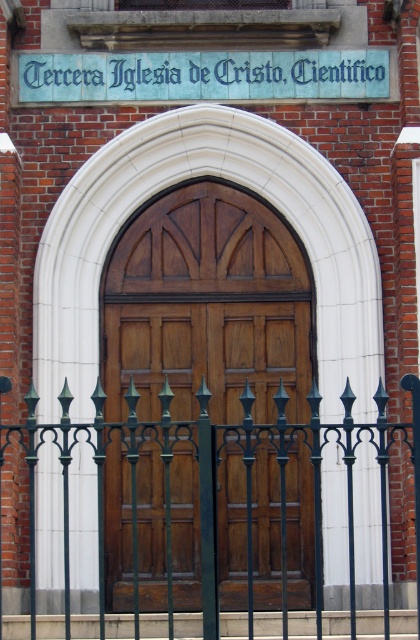
Consider the image. You are a delivery person trying to enter the Tercera Iglesia de Cristo, Cientifico building. You see the polished wood door at center and the green wrought iron fence at center. Which object is positioned higher relative to the other?

The polished wood door at center is above the green wrought iron fence at center, so the door is higher.

Based on the photo, you are standing at the entrance of the Tercera Iglesia de Cristo, Cientifico and looking at the black wrought iron fence in front of you. There are two points marked on the fence. One is at coordinate point (175, 529) and the other is at point (228, 97). Which point is closer to you?

Point (175, 529) is closer to you than point (228, 97).

You are standing at the entrance of the Tercera Iglesia de Cristo, Cientifico and looking at the black wrought iron fence in front of you. There are two points marked on the fence at coordinates point (301, 588) and point (157, 444). Which of these points is closer to your eyes?

Point (301, 588) is further to the viewer than point (157, 444), so the point closer to your eyes is point (157, 444).